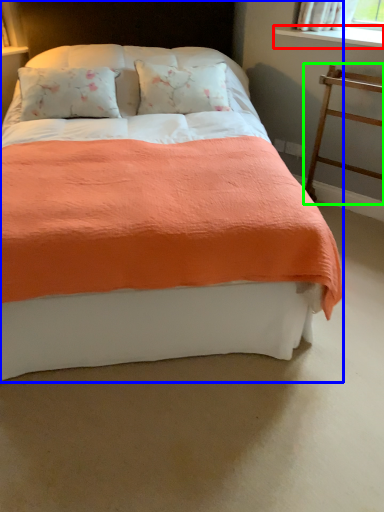
Question: Which object is positioned farthest from window sill (highlighted by a red box)? Select from bed (highlighted by a blue box) and balustrade (highlighted by a green box).

Choices:
 (A) bed
 (B) balustrade

Answer: (A)